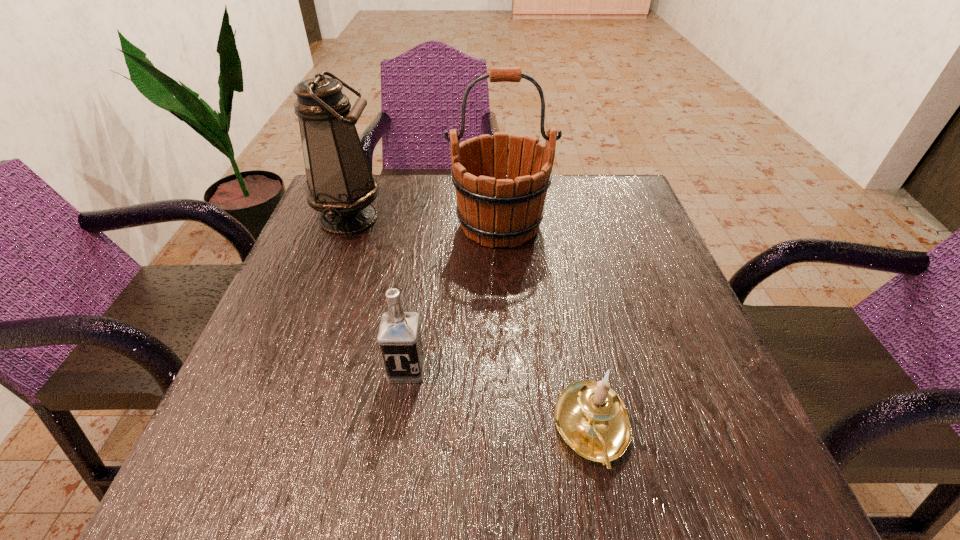
Where is `wine bucket`? wine bucket is located at coordinates (500, 206).

Where is `the leftmost object`? The image size is (960, 540). the leftmost object is located at coordinates tap(340, 185).

This screenshot has width=960, height=540. I want to click on the second shortest object, so click(399, 336).

Find the location of a particular element. vodka is located at coordinates (399, 336).

Find the location of `the shortest object`. the shortest object is located at coordinates (592, 419).

You are a GUI agent. You are given a task and a screenshot of the screen. Output one action in this format:
    pyautogui.click(x=<x>, y=<y>)
    Task: Click on the nearest object
    
    Given the screenshot: What is the action you would take?
    pyautogui.click(x=592, y=419)

Identify the location of vacant space located 0.090m on the front of the wine bucket. (503, 283).

This screenshot has height=540, width=960. I want to click on free location located on the front of the leftmost object, so click(x=328, y=271).

This screenshot has height=540, width=960. I want to click on vacant region located on the front label of the third farthest object, so click(389, 492).

Find the location of a particular element. wine bucket at the far edge is located at coordinates (500, 206).